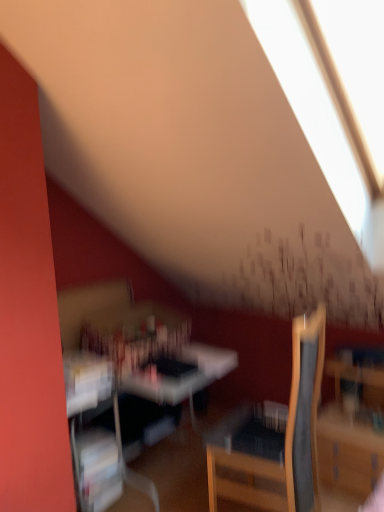
Describe the element at coordinates (276, 435) in the screenshot. I see `wooden chair at center` at that location.

Locate an element on the screen. This screenshot has width=384, height=512. wooden chair at center is located at coordinates point(276,435).

The height and width of the screenshot is (512, 384). I want to click on wooden chair at center, so click(x=276, y=435).